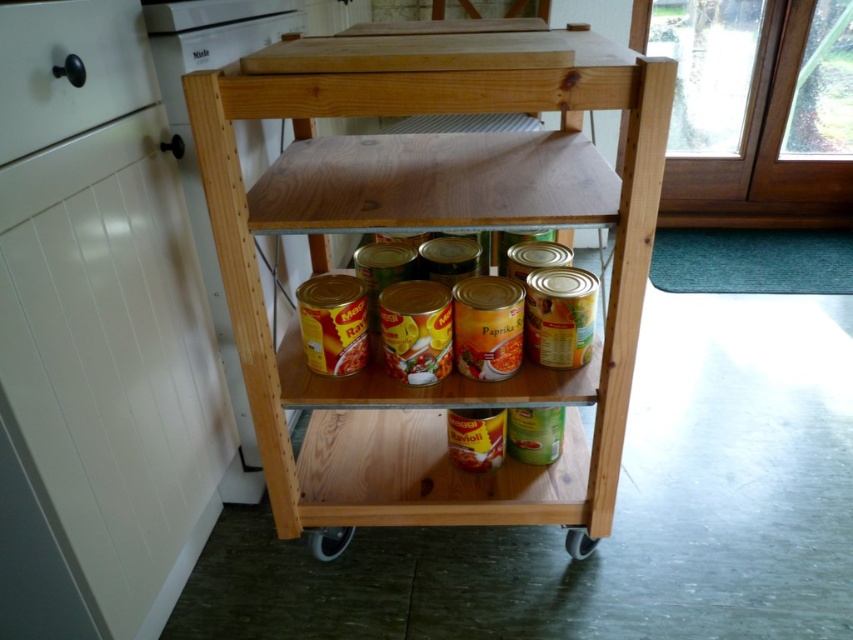
Question: Which is farther from the natural wood shelf at center?

Choices:
 (A) gray rubber wheel at lower center
 (B) black rubber wheel at lower center

Answer: (A)

Question: Which point is farther to the camera?

Choices:
 (A) 318,150
 (B) 312,532
 (C) 570,540

Answer: (C)

Question: Is natural wood shelf at center behind gray rubber wheel at lower center?

Choices:
 (A) no
 (B) yes

Answer: (A)

Question: Does natural wood shelf at center appear under black rubber wheel at lower center?

Choices:
 (A) no
 (B) yes

Answer: (A)

Question: Which point is farther from the camera taking this photo?

Choices:
 (A) (590, 548)
 (B) (534, 513)

Answer: (A)

Question: Can you confirm if natural wood shelf at center is positioned above gray rubber wheel at lower center?

Choices:
 (A) yes
 (B) no

Answer: (A)